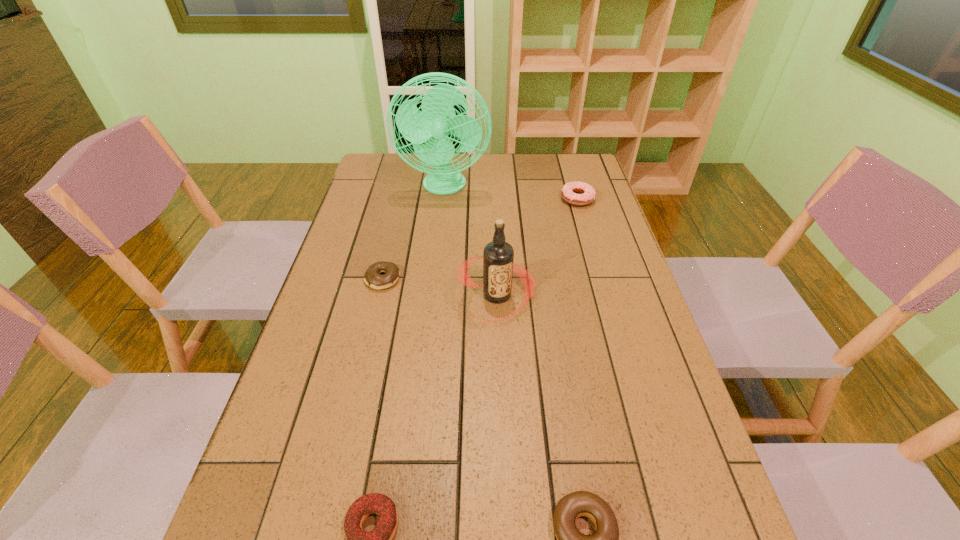
Where is `fan located in the left edge section of the desktop`? The width and height of the screenshot is (960, 540). fan located in the left edge section of the desktop is located at coordinates (437, 119).

This screenshot has height=540, width=960. Find the location of `doughnut located at the left edge`. doughnut located at the left edge is located at coordinates (372, 278).

Where is `object that is positioned at the right edge`? Image resolution: width=960 pixels, height=540 pixels. object that is positioned at the right edge is located at coordinates (578, 193).

I want to click on object positioned at the far left corner, so click(437, 119).

This screenshot has width=960, height=540. In order to click on vacant region at the far edge in this screenshot , I will do `click(520, 153)`.

What are the coordinates of `vacant space at the left edge of the desktop` in the screenshot? It's located at (359, 241).

Where is `free region at the right edge of the desktop`? free region at the right edge of the desktop is located at coordinates (592, 258).

Locate an element on the screen. This screenshot has height=540, width=960. vacant space at the far left corner is located at coordinates (404, 175).

In the image, there is a desktop. At what (x,y) coordinates should I click in order to perform the action: click on free space at the far right corner. Please return your answer as a coordinate pair (x, y). The width and height of the screenshot is (960, 540). Looking at the image, I should click on (562, 165).

What are the coordinates of `empty space that is in between the second farthest doughnut and the fan` in the screenshot? It's located at (414, 233).